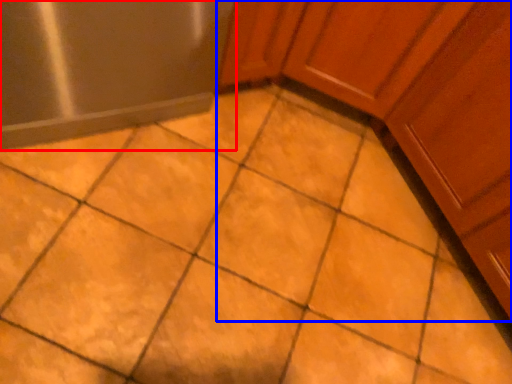
Question: Among these objects, which one is nearest to the camera, appliance (highlighted by a red box) or cabinetry (highlighted by a blue box)?

Choices:
 (A) appliance
 (B) cabinetry

Answer: (B)